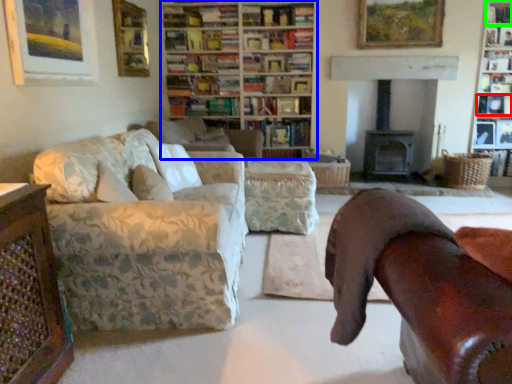
Question: Estimate the real-world distances between objects in this image. Which object is closer to book (highlighted by a red box), bookcase (highlighted by a blue box) or shelf (highlighted by a green box)?

Choices:
 (A) bookcase
 (B) shelf

Answer: (B)